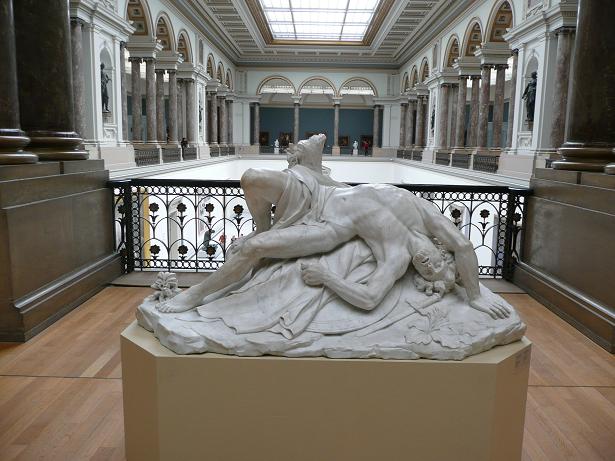
The image size is (615, 461). In order to click on skylight in this screenshot , I will do `click(318, 27)`.